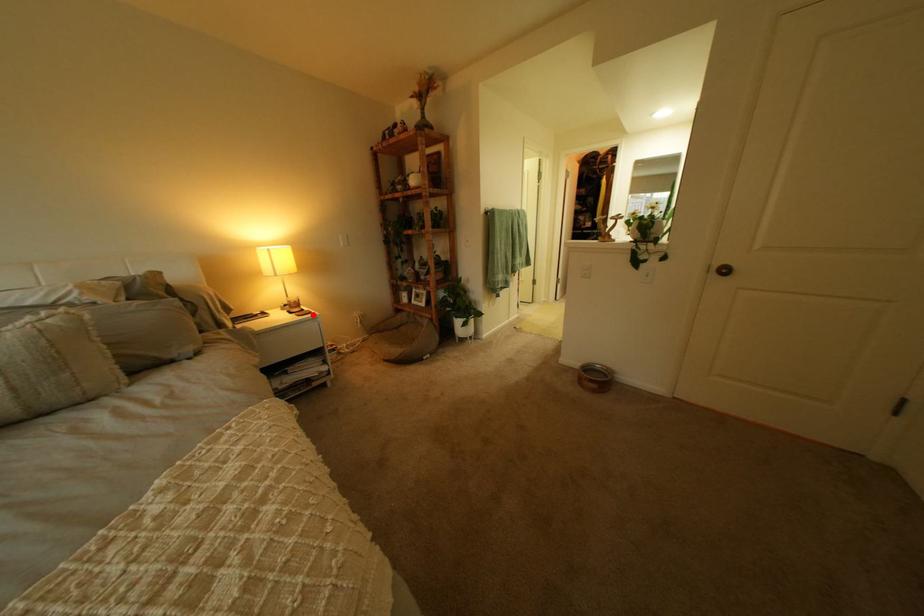
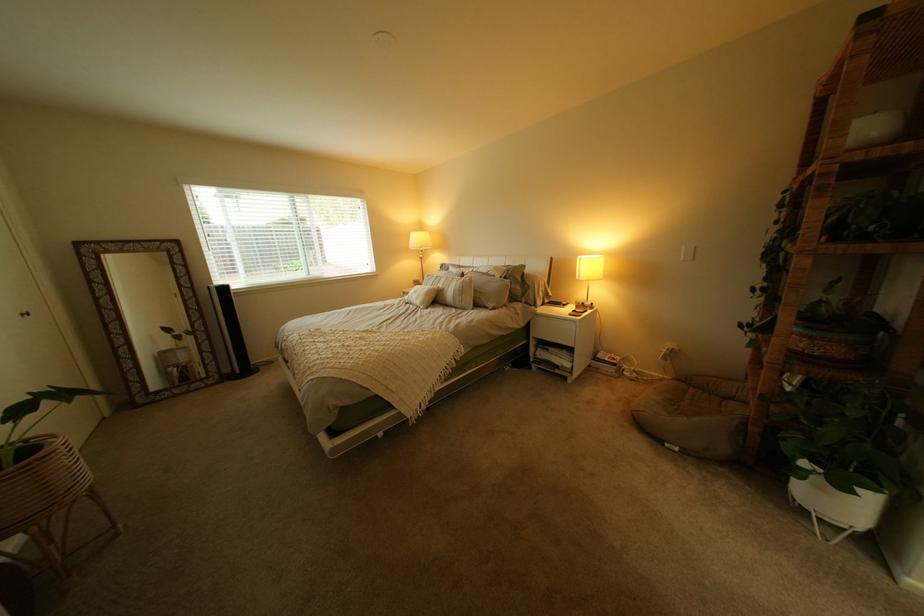
Question: I am providing you with two images of the same scene from different viewpoints. Image1 has a red point marked. In image2, the corresponding 3D location appears at what relative position? Reply with the corresponding letter.

Choices:
 (A) Closer
 (B) Farther

Answer: (B)